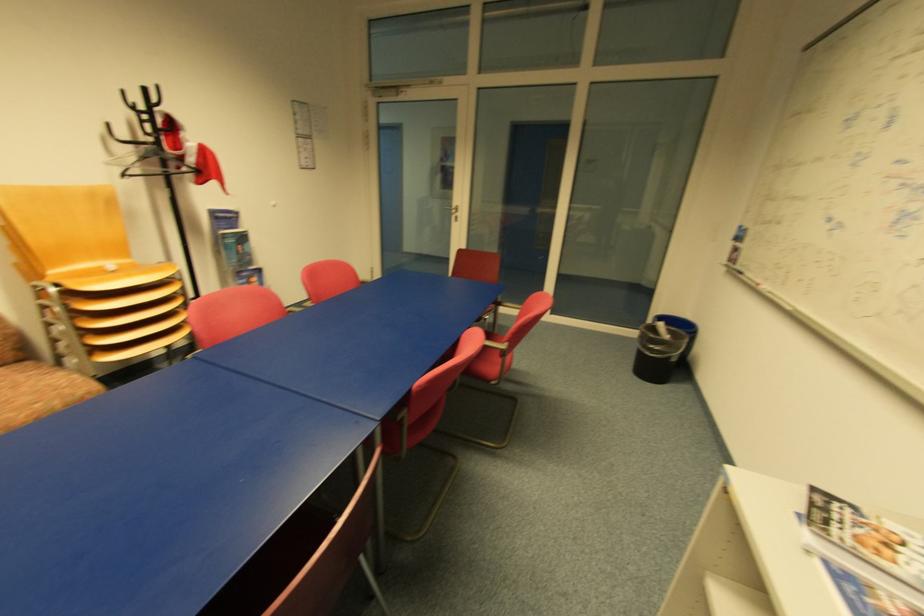
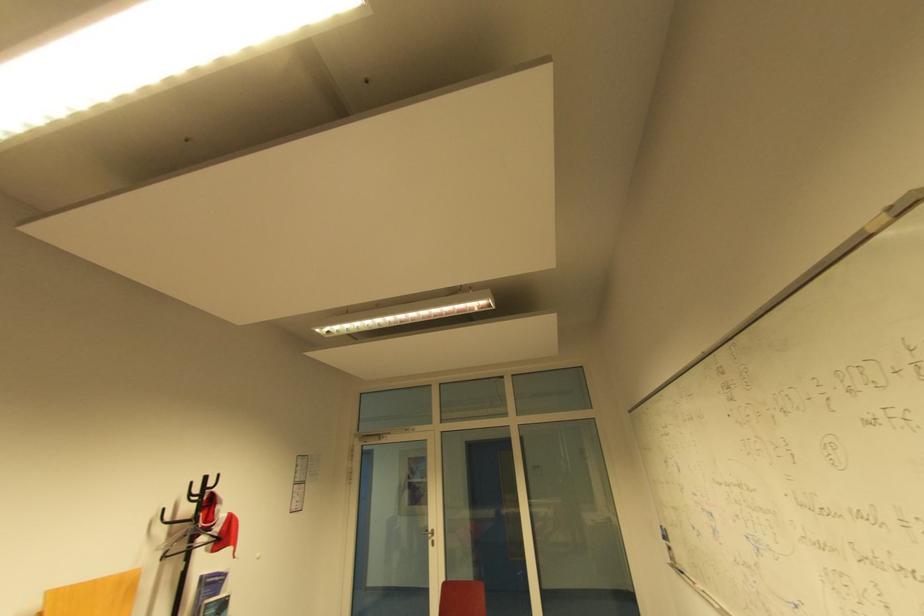
Where in the second image is the point corresponding to the point at 456,208 from the first image?

(434, 531)